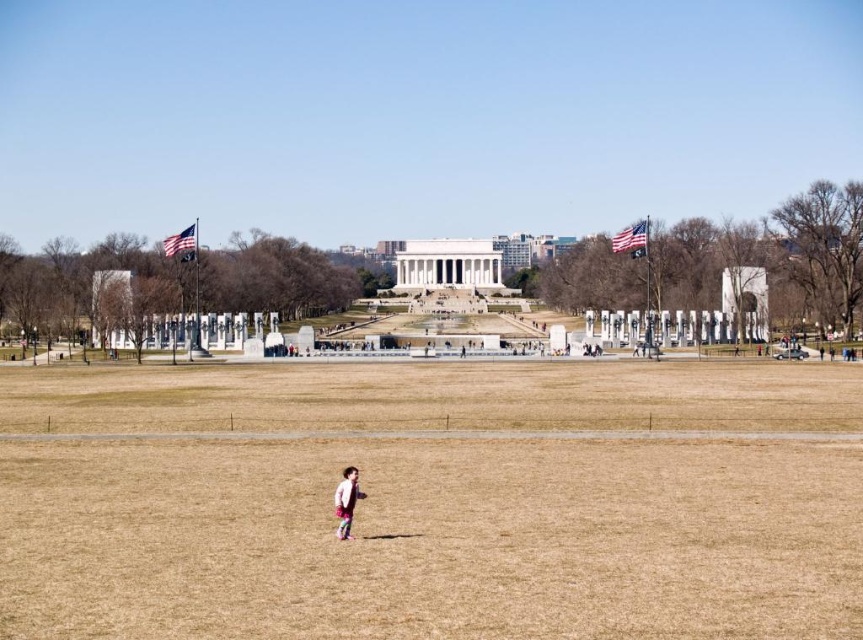
Does point (644, 445) come in front of point (343, 493)?

No, (644, 445) is further to viewer.

Who is more distant from viewer, (269, 499) or (344, 470)?

Point (344, 470)

Locate an element on the screen. brown grass at center is located at coordinates (432, 500).